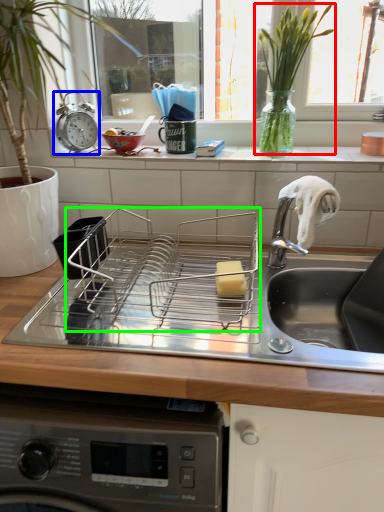
Question: Which is nearer to the plant (highlighted by a red box)? alarm clock (highlighted by a blue box) or appliance (highlighted by a green box).

Choices:
 (A) alarm clock
 (B) appliance

Answer: (B)